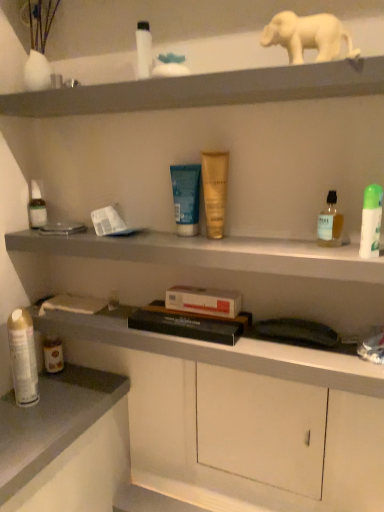
At what (x,y) coordinates should I click in order to perform the action: click on vacant space to the left of gold matte tube at center, which appears as the 4th toiletry when viewed from the left. Please return your answer as a coordinate pair (x, y). The image size is (384, 512). Looking at the image, I should click on (149, 240).